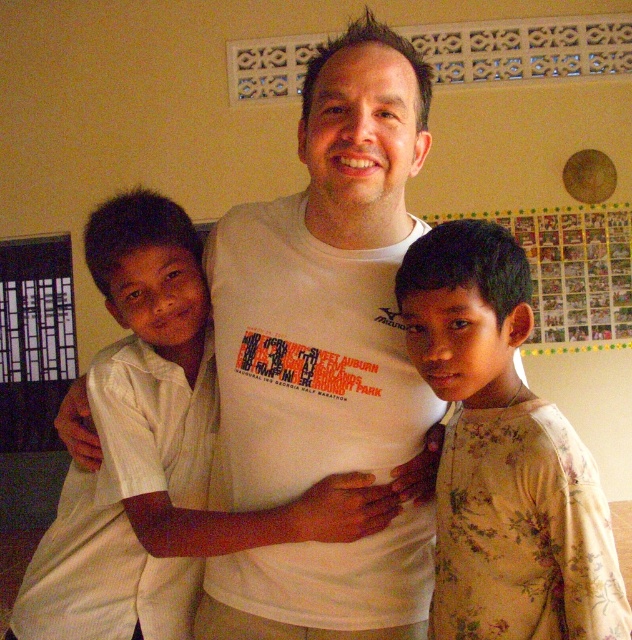
Question: Is white cotton t-shirt at center positioned behind floral cotton shirt at right?

Choices:
 (A) no
 (B) yes

Answer: (B)

Question: Among these objects, which one is farthest from the camera?

Choices:
 (A) floral cotton shirt at right
 (B) white cotton t-shirt at center

Answer: (B)

Question: Can you confirm if white cotton t-shirt at center is positioned to the left of floral cotton shirt at right?

Choices:
 (A) no
 (B) yes

Answer: (B)

Question: Is white cotton t-shirt at center behind floral cotton shirt at right?

Choices:
 (A) no
 (B) yes

Answer: (B)